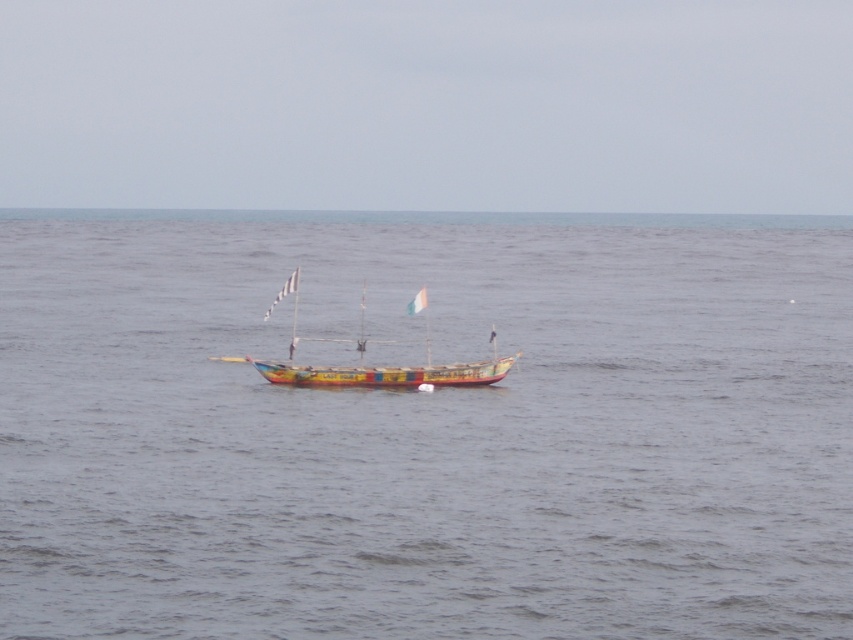
You are an observer standing on the shore looking at the painted wooden boat at center and the smooth gray water at center. Which object is located to the right of the other?

The smooth gray water at center is positioned on the right side of painted wooden boat at center, so the smooth gray water at center is to the right of the painted wooden boat at center.

You are an observer standing on the shore looking at the painted wooden boat at center and the smooth gray water at center. Which object appears taller from your perspective?

The smooth gray water at center appears taller than the painted wooden boat at center from your perspective.

You are an observer looking at the scene. Which object is closer to you, the smooth gray water at center or the painted wooden boat at center?

The smooth gray water at center is closer to the viewer than the painted wooden boat at center.